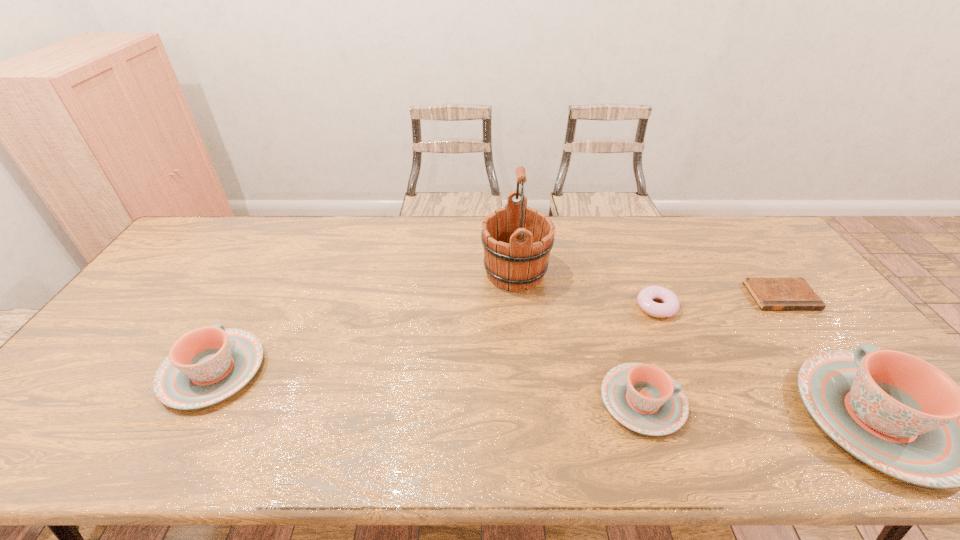
This screenshot has height=540, width=960. What are the coordinates of `vacant position for inserting another chinaware evenly` in the screenshot? It's located at (421, 385).